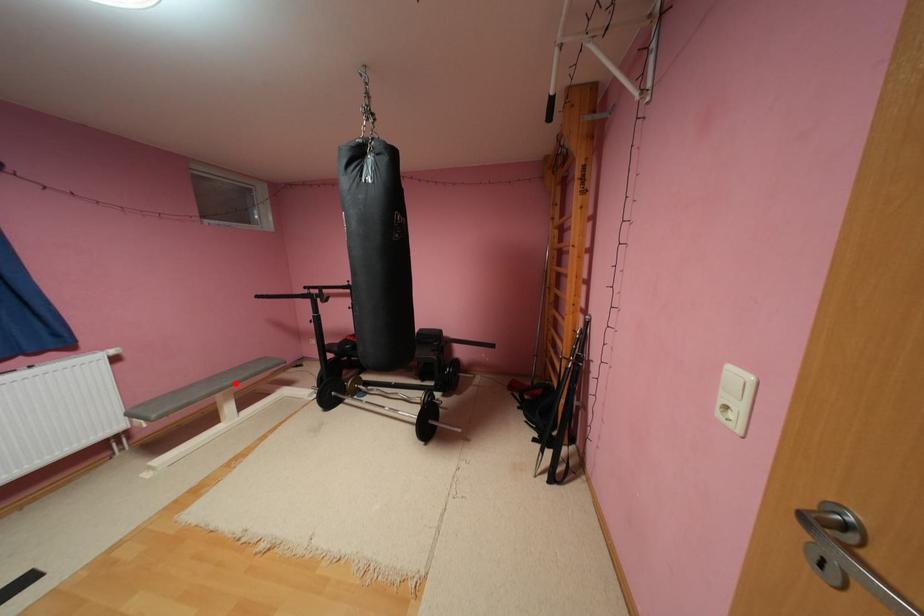
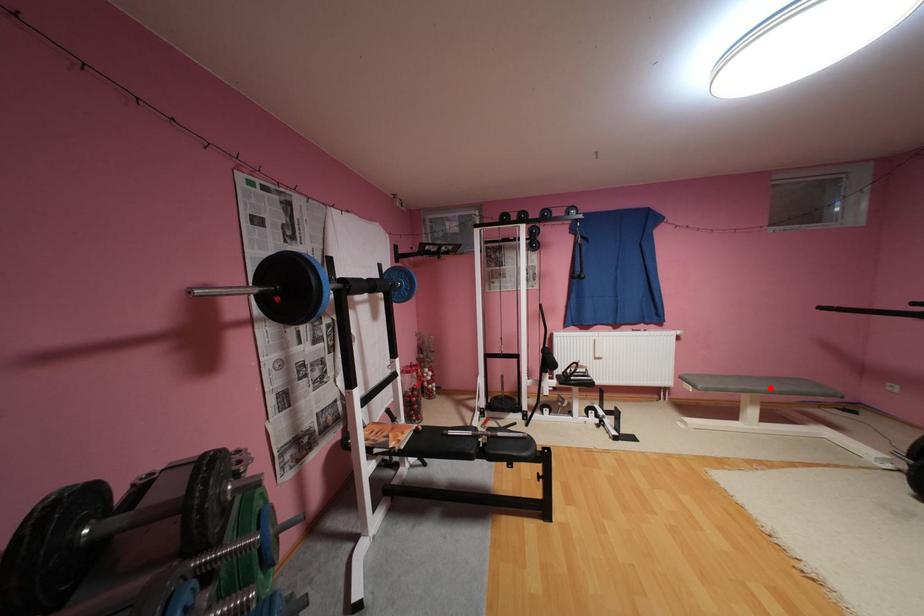
I am providing you with two images of the same scene from different viewpoints. A red point is marked on the first image and another point is marked on the second image. Do the highlighted points in image1 and image2 indicate the same real-world spot?

Yes